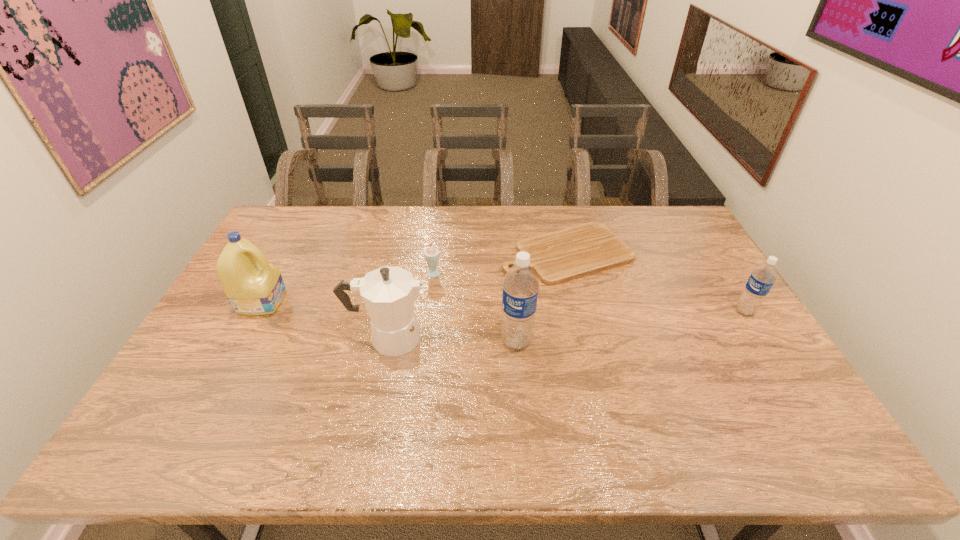
Find the location of a particular element. free space at the right edge of the desktop is located at coordinates (x=742, y=357).

Identify the location of vacant space at the far left corner of the desktop. This screenshot has height=540, width=960. (299, 214).

Locate an element on the screen. This screenshot has height=540, width=960. vacant region at the far right corner of the desktop is located at coordinates (653, 214).

This screenshot has height=540, width=960. In the image, there is a desktop. What are the coordinates of `free space at the near right corner` in the screenshot? It's located at (740, 407).

The width and height of the screenshot is (960, 540). I want to click on vacant area between the left water bottle and the shortest object, so click(x=541, y=297).

Locate which object is the fifth closest to the coffeepot. Please provide its 2D coordinates. Your answer should be formatted as a tuple, i.e. [(x, y)], where the tuple contains the x and y coordinates of a point satisfying the conditions above.

[(761, 280)]

Choose which object is the nearest neighbor to the milkshake. Please provide its 2D coordinates. Your answer should be formatted as a tuple, i.e. [(x, y)], where the tuple contains the x and y coordinates of a point satisfying the conditions above.

[(556, 257)]

The width and height of the screenshot is (960, 540). I want to click on vacant space that satisfies the following two spatial constraints: 1. on the front side of the fourth tallest object; 2. at the spout of the coffeepot, so click(761, 338).

Locate an element on the screen. vacant region that satisfies the following two spatial constraints: 1. on the front side of the shortest object; 2. on the right side of the farther water bottle is located at coordinates (581, 312).

Where is `free space that satisfies the following two spatial constraints: 1. on the back side of the chopping board; 2. on the right side of the tallest object`? The height and width of the screenshot is (540, 960). free space that satisfies the following two spatial constraints: 1. on the back side of the chopping board; 2. on the right side of the tallest object is located at coordinates (509, 253).